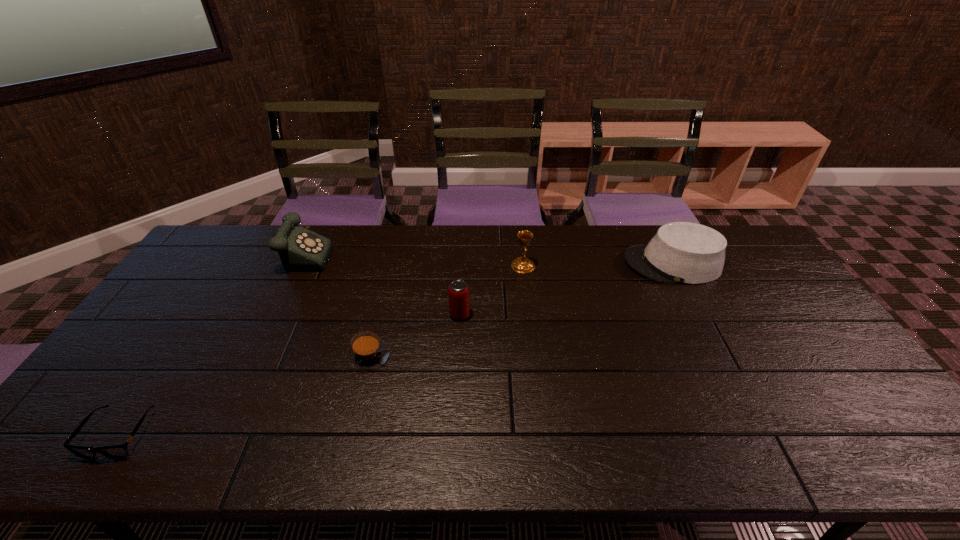
Identify which object is the fourth closest to the second object from right to left. Please provide its 2D coordinates. Your answer should be formatted as a tuple, i.e. [(x, y)], where the tuple contains the x and y coordinates of a point satisfying the conditions above.

[(300, 249)]

Locate an element on the screen. The image size is (960, 540). vacant space that satisfies the following two spatial constraints: 1. on the back side of the chalice; 2. on the dial of the telephone is located at coordinates (521, 251).

Find the location of `vacant space that satisfies the following two spatial constraints: 1. on the front-facing side of the hat; 2. on the front-facing side of the sunglasses`. vacant space that satisfies the following two spatial constraints: 1. on the front-facing side of the hat; 2. on the front-facing side of the sunglasses is located at coordinates (760, 434).

Identify the location of vacant space that satisfies the following two spatial constraints: 1. on the dial of the second nearest object; 2. on the left side of the telephone. The height and width of the screenshot is (540, 960). (253, 356).

Locate an element on the screen. free location that satisfies the following two spatial constraints: 1. on the dial of the fifth object from right to left; 2. on the front-facing side of the shortest object is located at coordinates (216, 434).

I want to click on vacant position in the image that satisfies the following two spatial constraints: 1. on the dial of the fifth object from right to left; 2. on the back side of the fourth object from left to right, so click(274, 315).

Where is `free region that satisfies the following two spatial constraints: 1. on the front-facing side of the hat; 2. on the front-facing side of the nearest object`? free region that satisfies the following two spatial constraints: 1. on the front-facing side of the hat; 2. on the front-facing side of the nearest object is located at coordinates (760, 434).